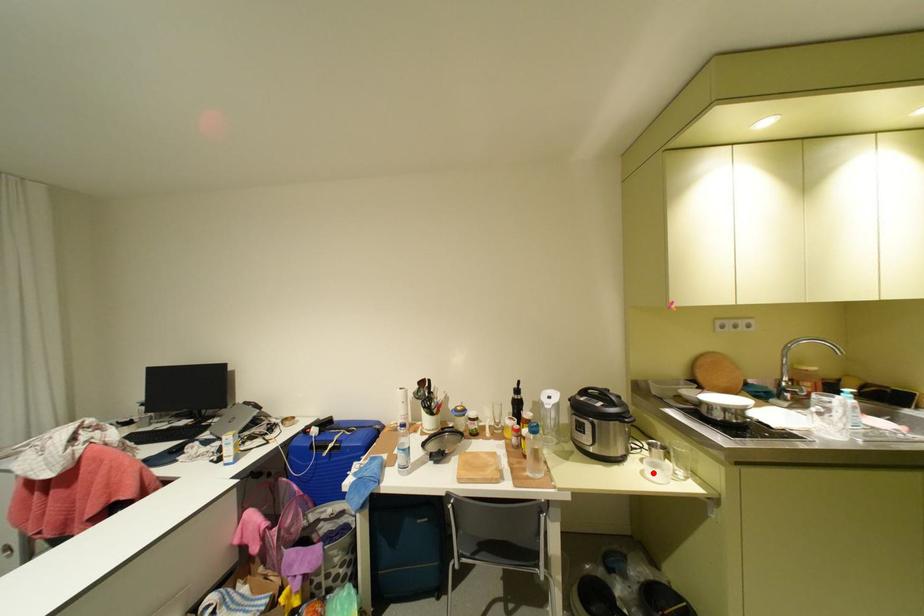
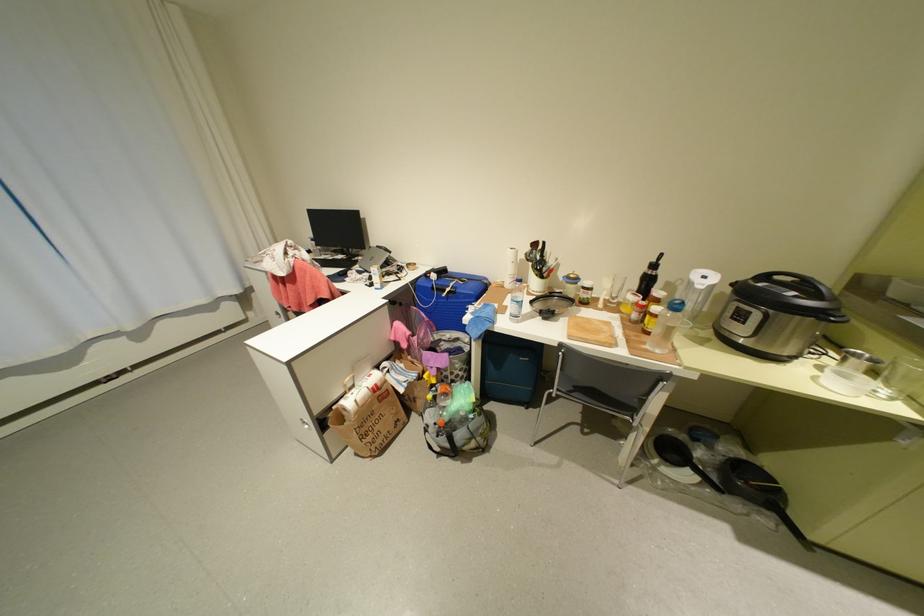
In the second image, find the point that corresponds to the highlighted location in the first image.

(824, 379)